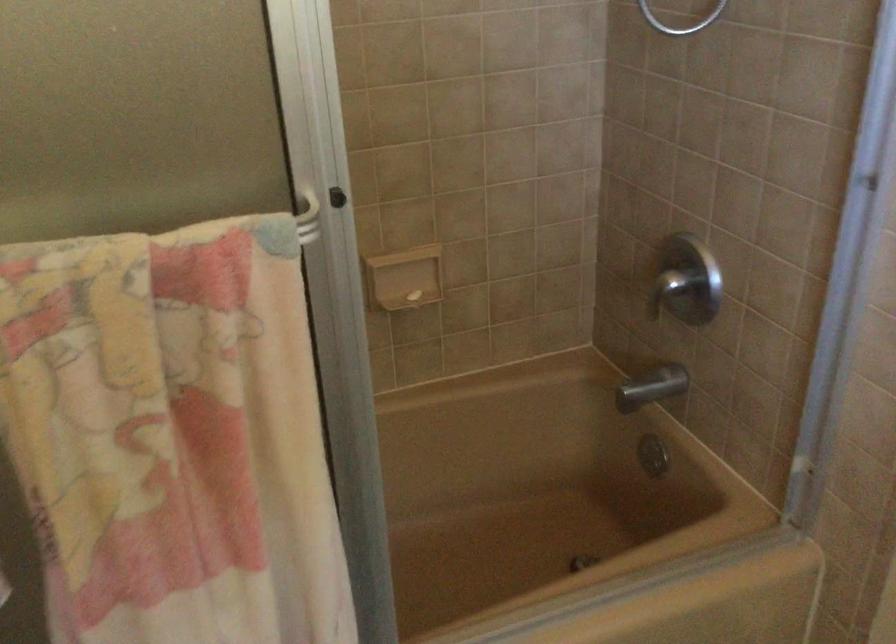
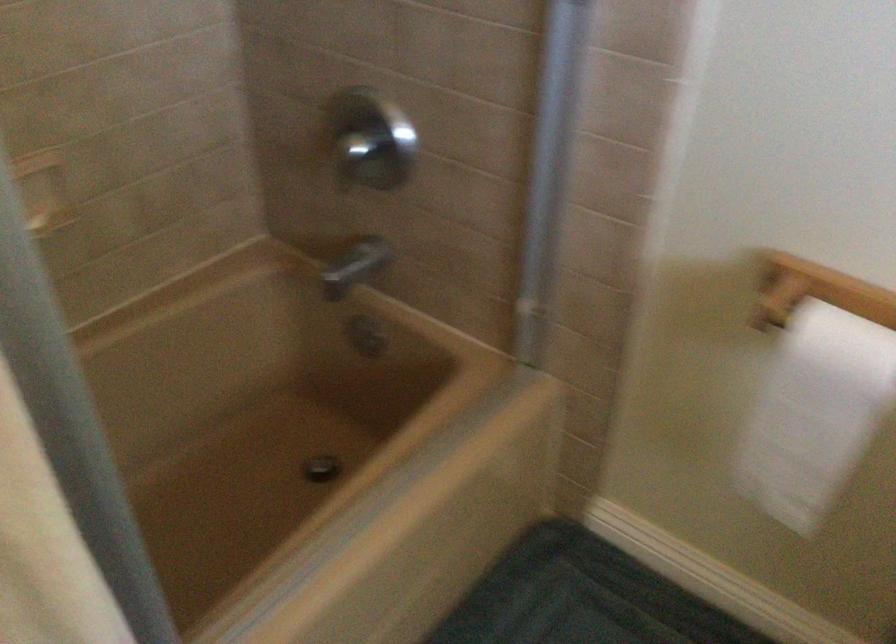
Question: The first image is from the beginning of the video and the second image is from the end. How did the camera likely rotate when shooting the video?

Choices:
 (A) Left
 (B) Right
 (C) Up
 (D) Down

Answer: (B)